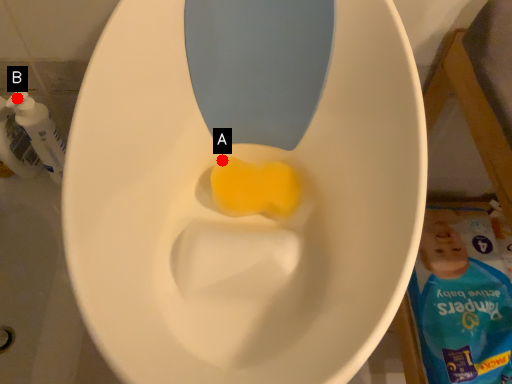
Question: Two points are circled on the image, labeled by A and B beside each circle. Which of the following is the closest to the observer?

Choices:
 (A) A is closer
 (B) B is closer

Answer: (A)